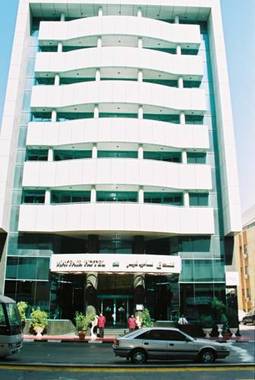
Identify the location of plant. (214, 332).